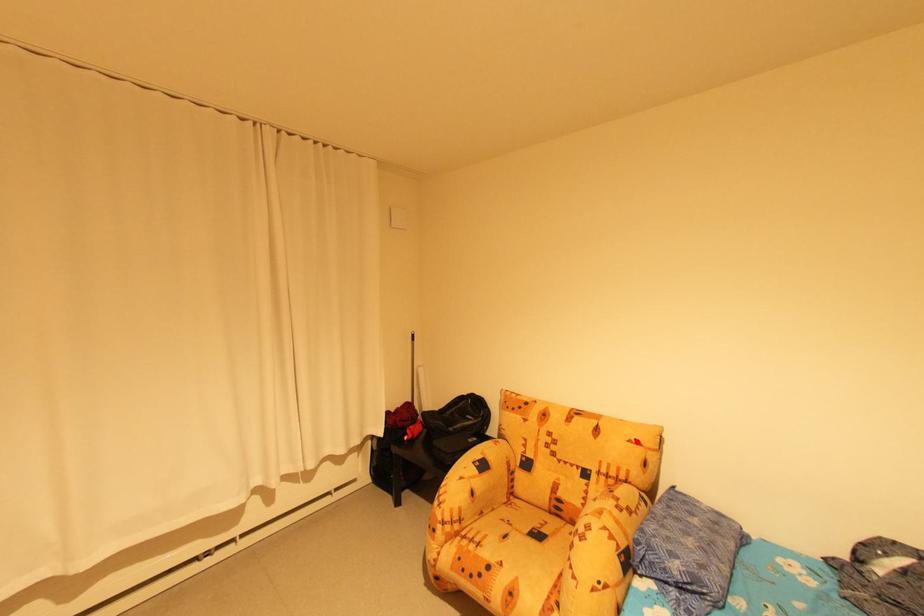
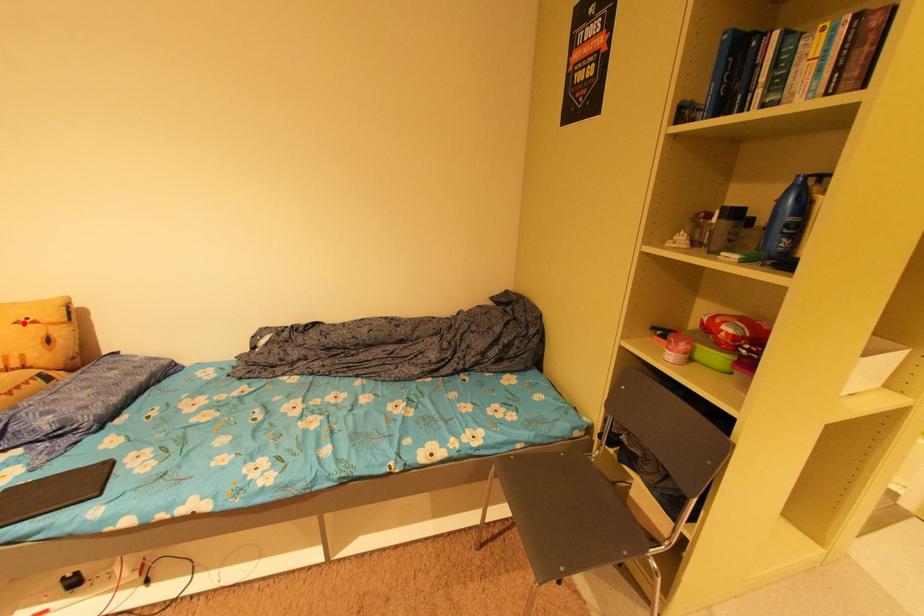
I am providing you with two images of the same scene from different viewpoints. A red point is marked on the first image and another point is marked on the second image. Does the point marked in image1 correspond to the same location as the one in image2?

Yes